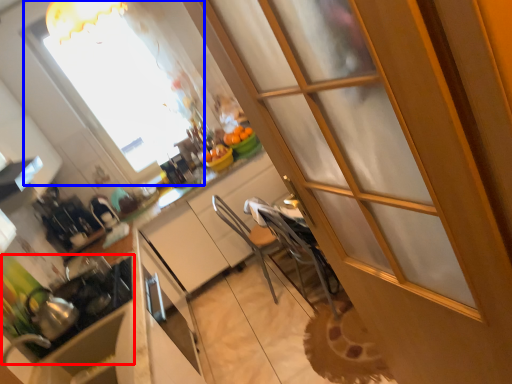
Question: Among these objects, which one is nearest to the camera, appliance (highlighted by a red box) or window (highlighted by a blue box)?

Choices:
 (A) appliance
 (B) window

Answer: (A)